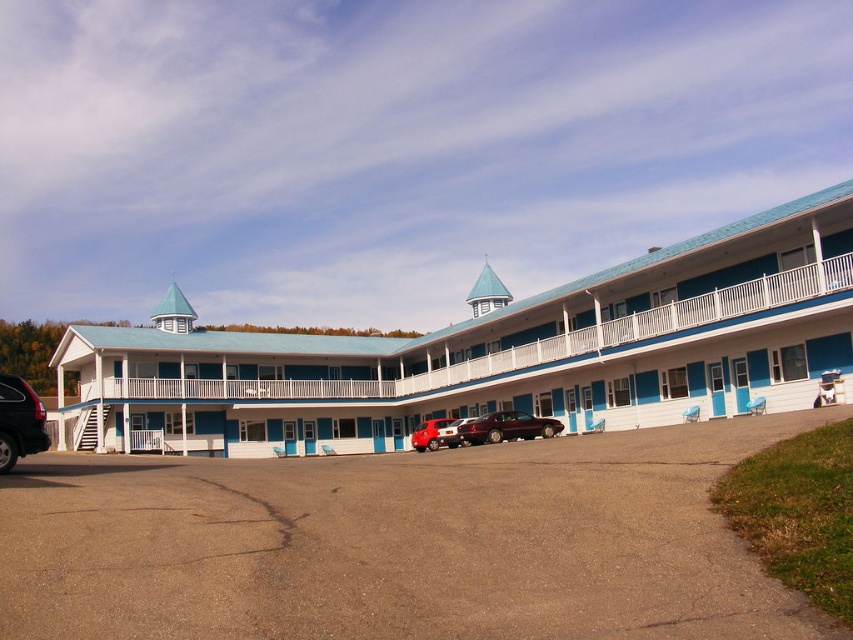
Question: Estimate the real-world distances between objects in this image. Which object is farther from the blue painted wood hotel at center?

Choices:
 (A) metallic silver van at center
 (B) matte black suv at lower left
 (C) shiny maroon sedan at center
 (D) metallic red truck at center

Answer: (B)

Question: Is asphalt at lower center in front of metallic silver van at center?

Choices:
 (A) no
 (B) yes

Answer: (B)

Question: Which object is positioned farthest from the shiny maroon sedan at center?

Choices:
 (A) matte black suv at lower left
 (B) metallic red truck at center

Answer: (A)

Question: Can you confirm if asphalt at lower center is smaller than shiny maroon sedan at center?

Choices:
 (A) yes
 (B) no

Answer: (B)

Question: Does metallic silver van at center have a greater width compared to metallic red truck at center?

Choices:
 (A) yes
 (B) no

Answer: (A)

Question: Which point appears closest to the camera in this image?

Choices:
 (A) (421, 429)
 (B) (22, 445)

Answer: (B)